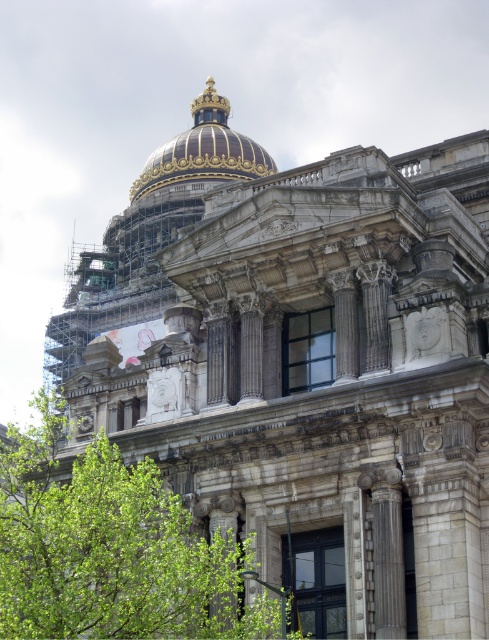
Question: Which point is closer to the camera taking this photo?

Choices:
 (A) (173, 145)
 (B) (25, 515)

Answer: (B)

Question: Is green leafy tree at center further to camera compared to goldmetallicdome at upper center?

Choices:
 (A) no
 (B) yes

Answer: (A)

Question: Is the position of green leafy tree at center more distant than that of goldmetallicdome at upper center?

Choices:
 (A) yes
 (B) no

Answer: (B)

Question: Is green leafy tree at center wider than goldmetallicdome at upper center?

Choices:
 (A) yes
 (B) no

Answer: (A)

Question: Which point is farther from the camera taking this photo?

Choices:
 (A) (172, 154)
 (B) (140, 476)

Answer: (A)

Question: Which object is farther from the camera taking this photo?

Choices:
 (A) green leafy tree at center
 (B) goldmetallicdome at upper center

Answer: (B)